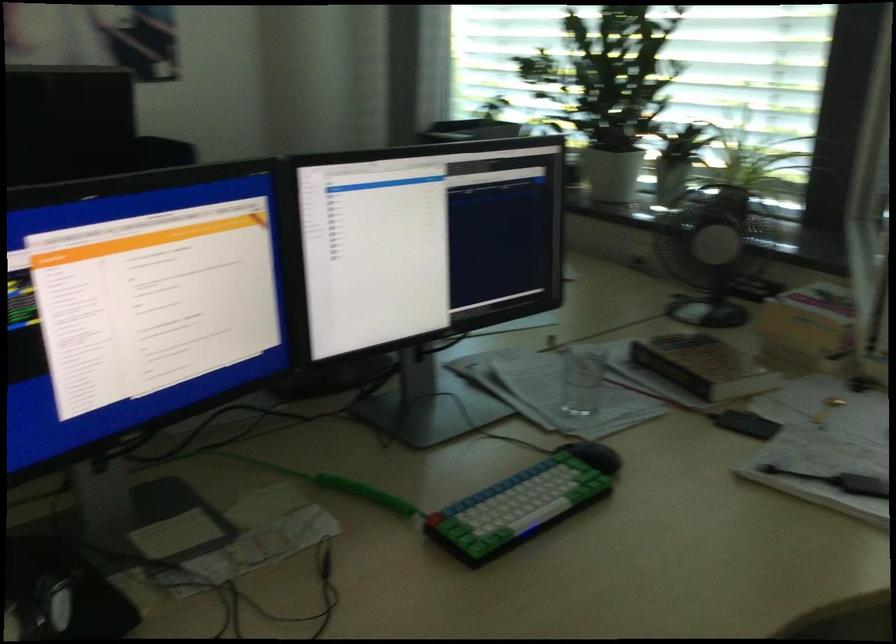
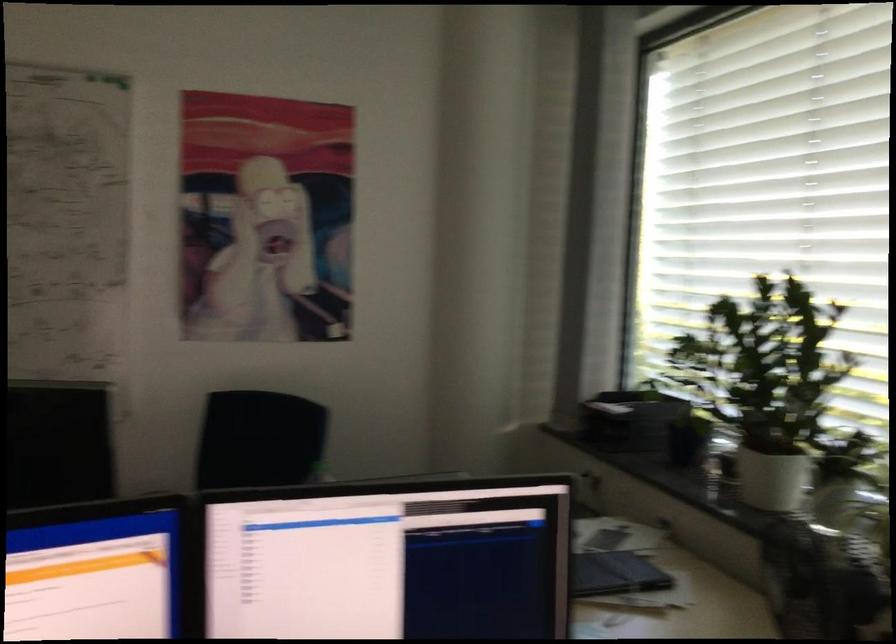
The point at (x=629, y=174) is marked in the first image. Where is the corresponding point in the second image?

(770, 478)